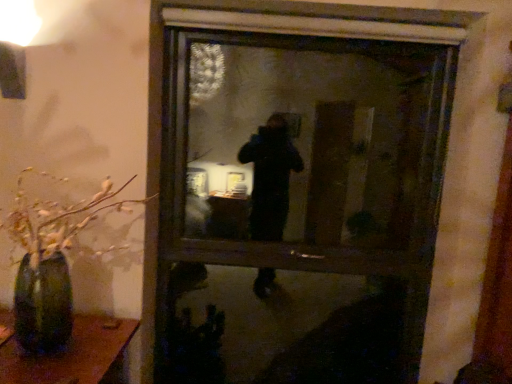
Question: Is green matte vase at left inside the boundaries of transparent glass window at center, or outside?

Choices:
 (A) outside
 (B) inside

Answer: (A)

Question: Considering the positions of green matte vase at left and transparent glass window at center in the image, is green matte vase at left taller or shorter than transparent glass window at center?

Choices:
 (A) short
 (B) tall

Answer: (A)

Question: From the image's perspective, is green matte vase at left above or below transparent glass window at center?

Choices:
 (A) above
 (B) below

Answer: (B)

Question: From the image's perspective, is transparent glass window at center positioned above or below green matte vase at left?

Choices:
 (A) above
 (B) below

Answer: (A)

Question: Is transparent glass window at center inside the boundaries of green matte vase at left, or outside?

Choices:
 (A) outside
 (B) inside

Answer: (A)

Question: Based on their sizes in the image, would you say transparent glass window at center is bigger or smaller than green matte vase at left?

Choices:
 (A) big
 (B) small

Answer: (A)

Question: Visually, is transparent glass window at center positioned to the left or to the right of green matte vase at left?

Choices:
 (A) right
 (B) left

Answer: (A)